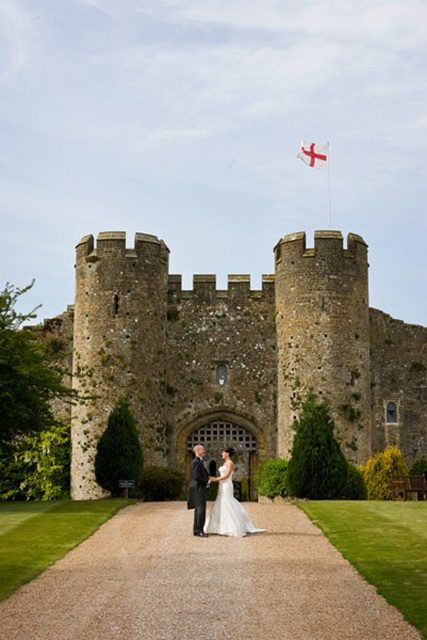
Question: Estimate the real-world distances between objects in this image. Which object is closer to the white fabric flag at upper center?

Choices:
 (A) stone textured castle at center
 (B) white satin dress at center

Answer: (A)

Question: Can you confirm if white satin dress at center is positioned to the right of dark gray suit at center?

Choices:
 (A) no
 (B) yes

Answer: (B)

Question: Is stone textured castle at center thinner than dark gray suit at center?

Choices:
 (A) no
 (B) yes

Answer: (A)

Question: Which object is positioned farthest from the white satin dress at center?

Choices:
 (A) white fabric flag at upper center
 (B) dark gray suit at center

Answer: (A)

Question: Which of the following is the closest to the observer?

Choices:
 (A) (193, 465)
 (B) (312, 161)
 (C) (193, 381)

Answer: (A)

Question: Is stone textured castle at center to the right of white satin dress at center from the viewer's perspective?

Choices:
 (A) no
 (B) yes

Answer: (B)